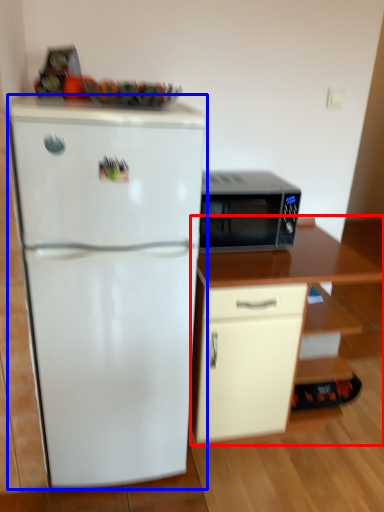
Question: Which object is further to the camera taking this photo, cabinetry (highlighted by a red box) or refrigerator (highlighted by a blue box)?

Choices:
 (A) cabinetry
 (B) refrigerator

Answer: (A)